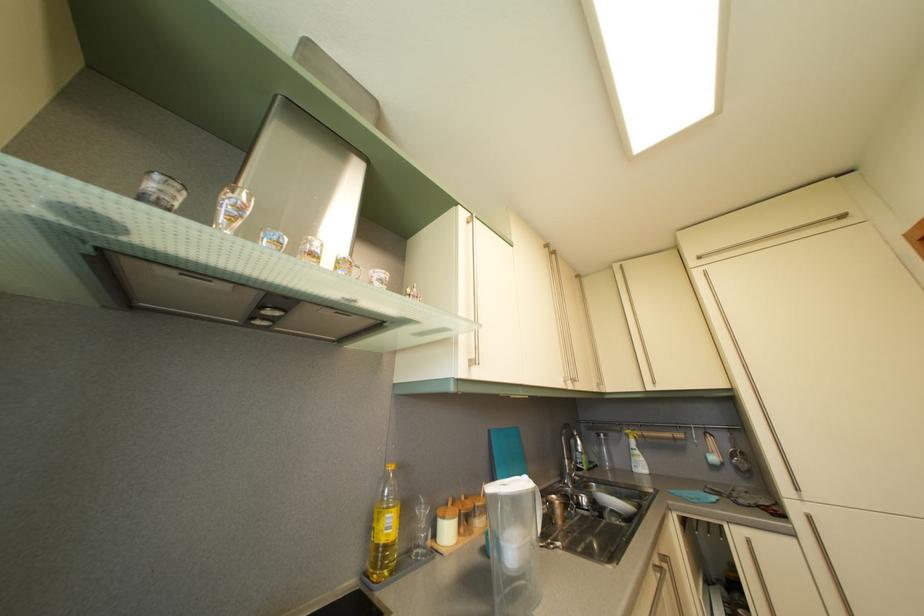
You are a GUI agent. You are given a task and a screenshot of the screen. Output one action in this format:
    pyautogui.click(x=<x>, y=<y>)
    Task: Click on the stove hood button
    The width and height of the screenshot is (924, 616).
    Given the screenshot: What is the action you would take?
    pyautogui.click(x=264, y=315)